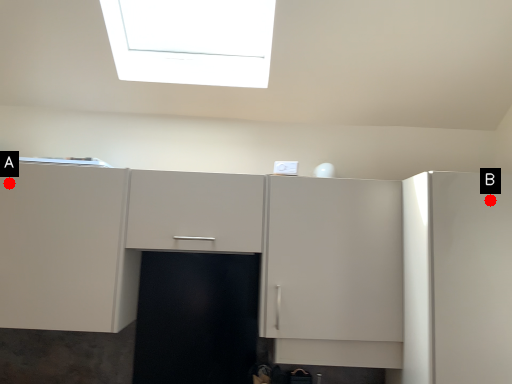
Question: Two points are circled on the image, labeled by A and B beside each circle. Which of the following is the closest to the observer?

Choices:
 (A) A is closer
 (B) B is closer

Answer: (B)